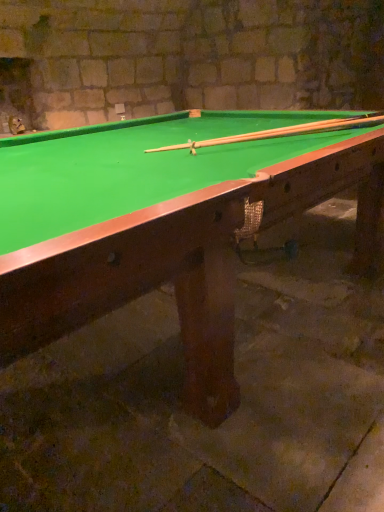
Question: Is green felt billiard table at center thinner than wooden cue at center?

Choices:
 (A) no
 (B) yes

Answer: (A)

Question: Can you confirm if green felt billiard table at center is wider than wooden cue at center?

Choices:
 (A) no
 (B) yes

Answer: (B)

Question: Considering the relative sizes of green felt billiard table at center and wooden cue at center in the image provided, is green felt billiard table at center taller than wooden cue at center?

Choices:
 (A) no
 (B) yes

Answer: (B)

Question: Considering the relative sizes of green felt billiard table at center and wooden cue at center in the image provided, is green felt billiard table at center bigger than wooden cue at center?

Choices:
 (A) no
 (B) yes

Answer: (B)

Question: Considering the relative sizes of green felt billiard table at center and wooden cue at center in the image provided, is green felt billiard table at center shorter than wooden cue at center?

Choices:
 (A) yes
 (B) no

Answer: (B)

Question: Can you confirm if green felt billiard table at center is smaller than wooden cue at center?

Choices:
 (A) yes
 (B) no

Answer: (B)

Question: Is wooden cue at center beside green felt billiard table at center?

Choices:
 (A) yes
 (B) no

Answer: (B)

Question: From the image's perspective, is wooden cue at center located beneath green felt billiard table at center?

Choices:
 (A) no
 (B) yes

Answer: (A)

Question: Is wooden cue at center looking in the opposite direction of green felt billiard table at center?

Choices:
 (A) no
 (B) yes

Answer: (B)

Question: From a real-world perspective, is wooden cue at center on top of green felt billiard table at center?

Choices:
 (A) yes
 (B) no

Answer: (A)

Question: Does wooden cue at center come behind green felt billiard table at center?

Choices:
 (A) yes
 (B) no

Answer: (A)

Question: Is green felt billiard table at center completely or partially inside wooden cue at center?

Choices:
 (A) yes
 (B) no

Answer: (B)

Question: Is green felt billiard table at center taller or shorter than wooden cue at center?

Choices:
 (A) tall
 (B) short

Answer: (A)